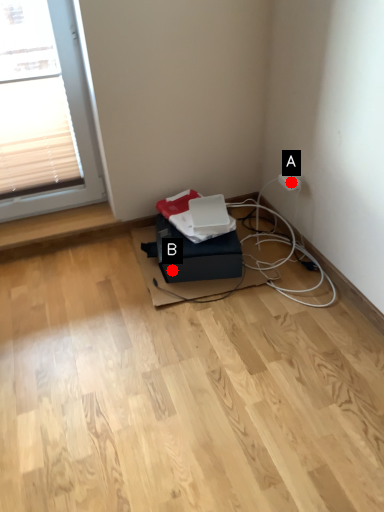
Question: Two points are circled on the image, labeled by A and B beside each circle. Which point is farther from the camera taking this photo?

Choices:
 (A) A is further
 (B) B is further

Answer: (A)